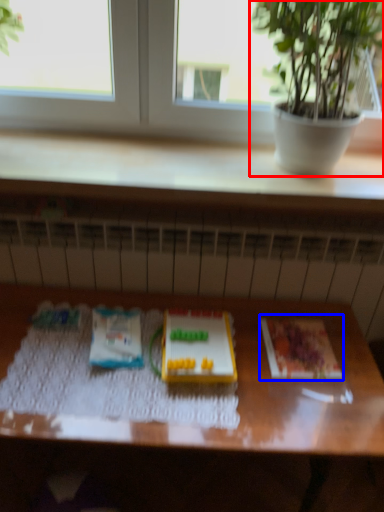
Question: Which of the following is the closest to the observer, houseplant (highlighted by a red box) or paperback book (highlighted by a blue box)?

Choices:
 (A) houseplant
 (B) paperback book

Answer: (A)